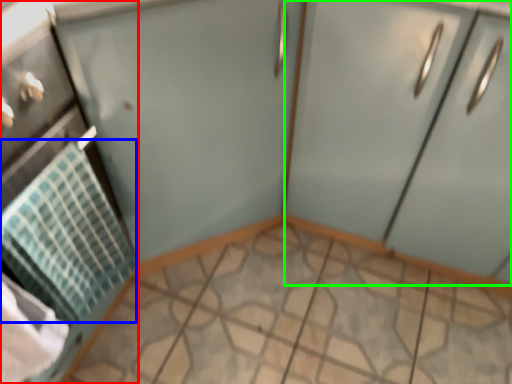
Question: Which is farther away from appliance (highlighted by a red box)? blanket (highlighted by a blue box) or cabinetry (highlighted by a green box)?

Choices:
 (A) blanket
 (B) cabinetry

Answer: (B)